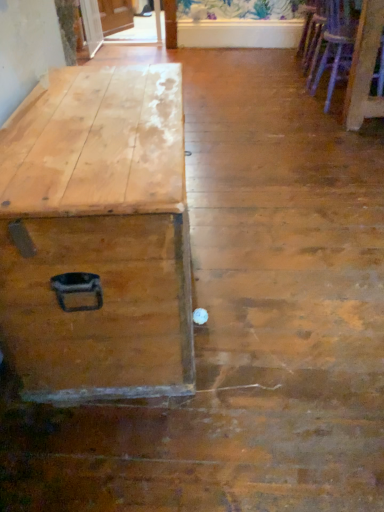
Question: From the image's perspective, is wooden armchair at upper right, the 1th armchair from the back, located above wooden armchair at right, positioned as the first armchair in bottom-to-top order?

Choices:
 (A) no
 (B) yes

Answer: (B)

Question: Considering the relative positions of wooden armchair at upper right, the 1th armchair from the back, and wooden armchair at right, placed as the first armchair when sorted from front to back, in the image provided, is wooden armchair at upper right, the 1th armchair from the back, to the right of wooden armchair at right, placed as the first armchair when sorted from front to back, from the viewer's perspective?

Choices:
 (A) no
 (B) yes

Answer: (A)

Question: Does wooden armchair at upper right, the second armchair when ordered from bottom to top, appear on the left side of wooden armchair at right, which is the second armchair in back-to-front order?

Choices:
 (A) yes
 (B) no

Answer: (A)

Question: From the image's perspective, would you say wooden armchair at upper right, the 2th armchair when ordered from front to back, is shown under wooden armchair at right, arranged as the 2th armchair when viewed from the top?

Choices:
 (A) yes
 (B) no

Answer: (B)

Question: From a real-world perspective, is wooden armchair at upper right, the 1th armchair from the back, physically above wooden armchair at right, arranged as the 2th armchair when viewed from the top?

Choices:
 (A) no
 (B) yes

Answer: (A)

Question: Is wooden armchair at upper right, the 2th armchair when ordered from front to back, not within wooden armchair at right, arranged as the 2th armchair when viewed from the top?

Choices:
 (A) no
 (B) yes

Answer: (B)

Question: Is wooden armchair at right, which is the second armchair in back-to-front order, positioned beyond the bounds of wooden armchair at upper right, the first armchair viewed from the top?

Choices:
 (A) no
 (B) yes

Answer: (B)

Question: Considering the relative sizes of wooden armchair at right, placed as the first armchair when sorted from front to back, and wooden armchair at upper right, the first armchair viewed from the top, in the image provided, is wooden armchair at right, placed as the first armchair when sorted from front to back, taller than wooden armchair at upper right, the first armchair viewed from the top,?

Choices:
 (A) no
 (B) yes

Answer: (B)

Question: Is wooden armchair at upper right, the first armchair viewed from the top, surrounded by wooden armchair at right, which is the second armchair in back-to-front order?

Choices:
 (A) yes
 (B) no

Answer: (B)

Question: Does wooden armchair at right, positioned as the first armchair in bottom-to-top order, turn towards wooden armchair at upper right, the 2th armchair when ordered from front to back?

Choices:
 (A) no
 (B) yes

Answer: (A)

Question: Can you confirm if wooden armchair at right, arranged as the 2th armchair when viewed from the top, is bigger than wooden armchair at upper right, the second armchair when ordered from bottom to top?

Choices:
 (A) yes
 (B) no

Answer: (A)

Question: Is wooden armchair at right, positioned as the first armchair in bottom-to-top order, at the right side of wooden armchair at upper right, the second armchair when ordered from bottom to top?

Choices:
 (A) no
 (B) yes

Answer: (B)

Question: Is natural wood trunk at left oriented away from wooden armchair at upper right, the second armchair when ordered from bottom to top?

Choices:
 (A) no
 (B) yes

Answer: (A)